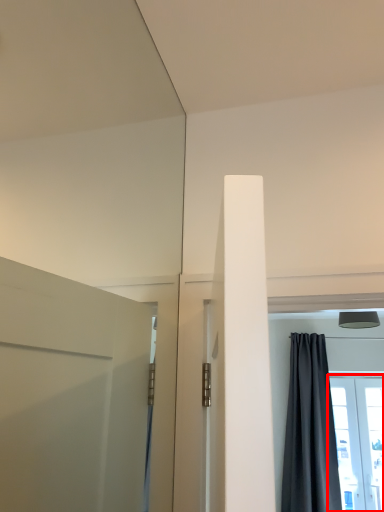
Question: From the image, what is the correct spatial relationship of window (annotated by the red box) in relation to curtain?

Choices:
 (A) right
 (B) left

Answer: (A)